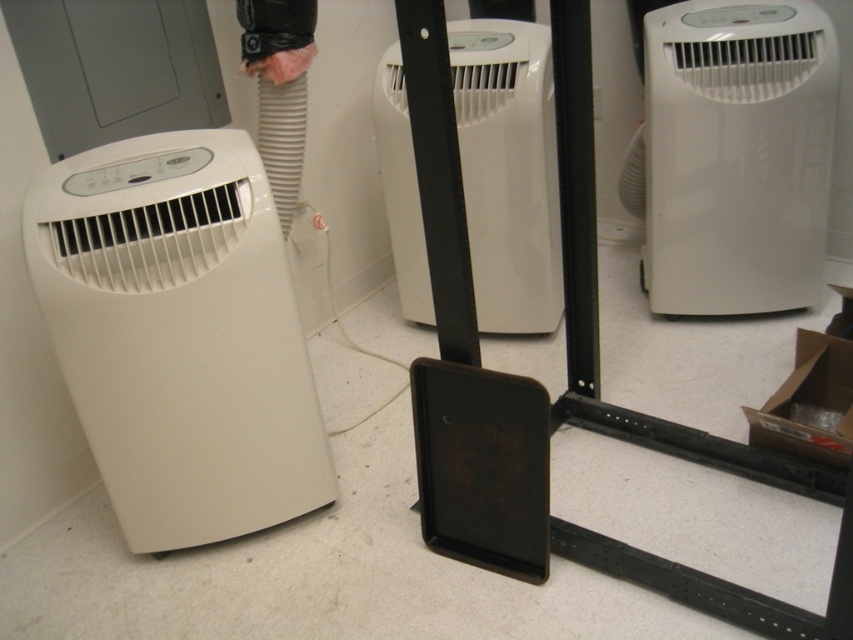
You are an interior designer planning to place a new sofa in the room. The sofa is 1.5 meters wide. You want to place it between the white matte portable air conditioner at left and the white glossy air conditioner at center. Is there enough space between them to fit the sofa?

The white matte portable air conditioner at left is smaller than the white glossy air conditioner at center. However, the exact distance between them isn

You are an installer setting up these air conditioners. You need to ensure that the white matte portable air conditioner at left is not blocked by the white plastic air conditioner at center. Is this currently the case?

The white matte portable air conditioner at left is positioned under the white plastic air conditioner at center, so it is blocked by the one above it. You need to adjust their positions to prevent obstruction.